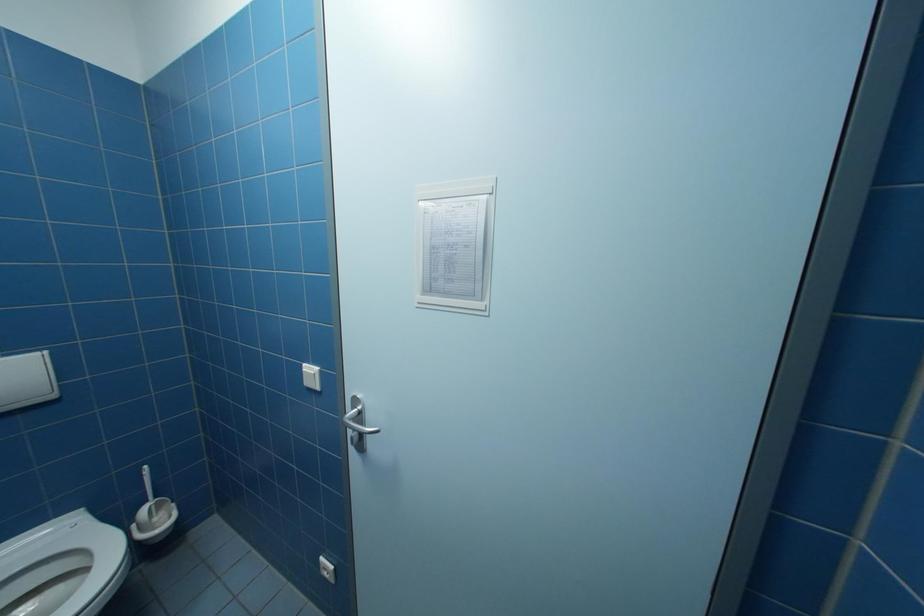
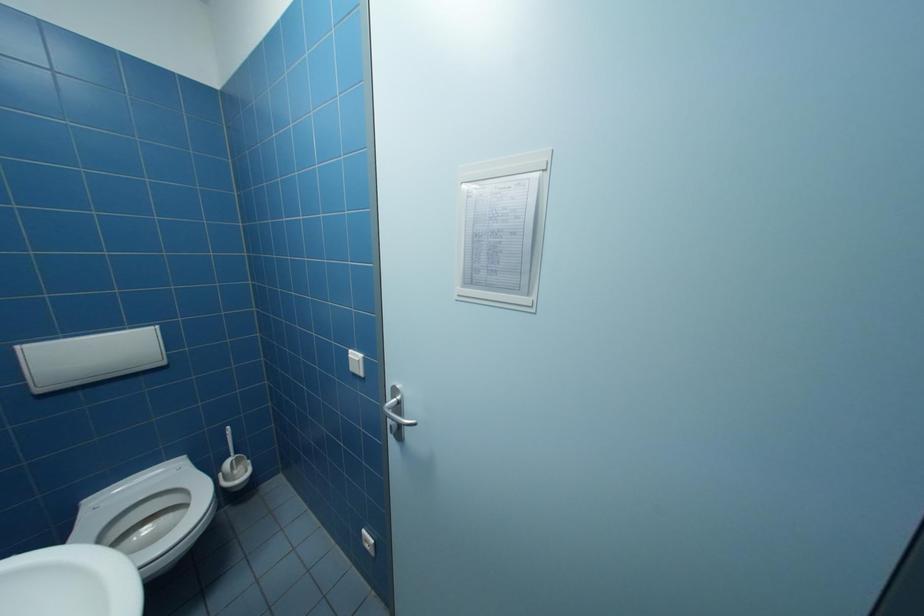
Question: What movement of the cameraman would produce the second image?

Choices:
 (A) Left
 (B) Right
 (C) Forward
 (D) Backward

Answer: (C)